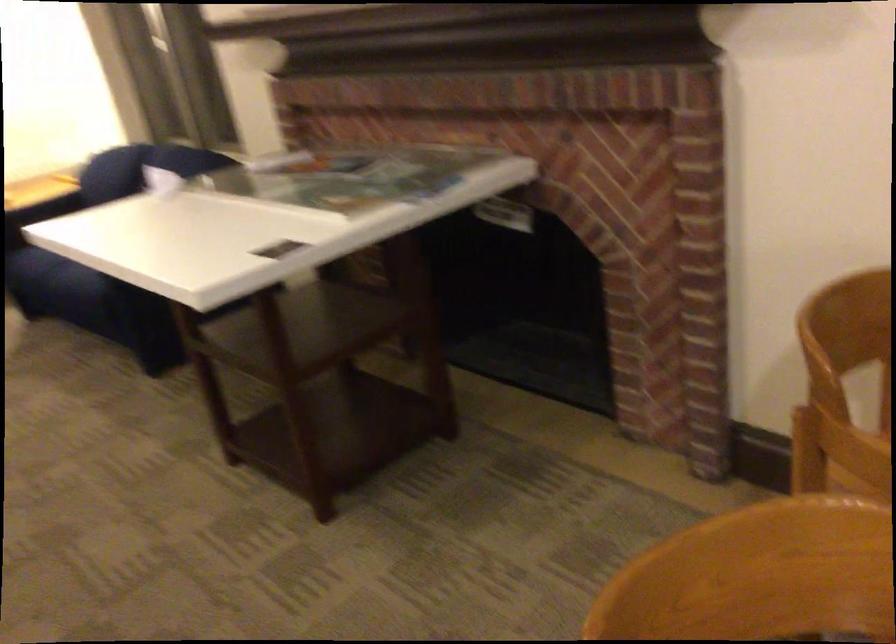
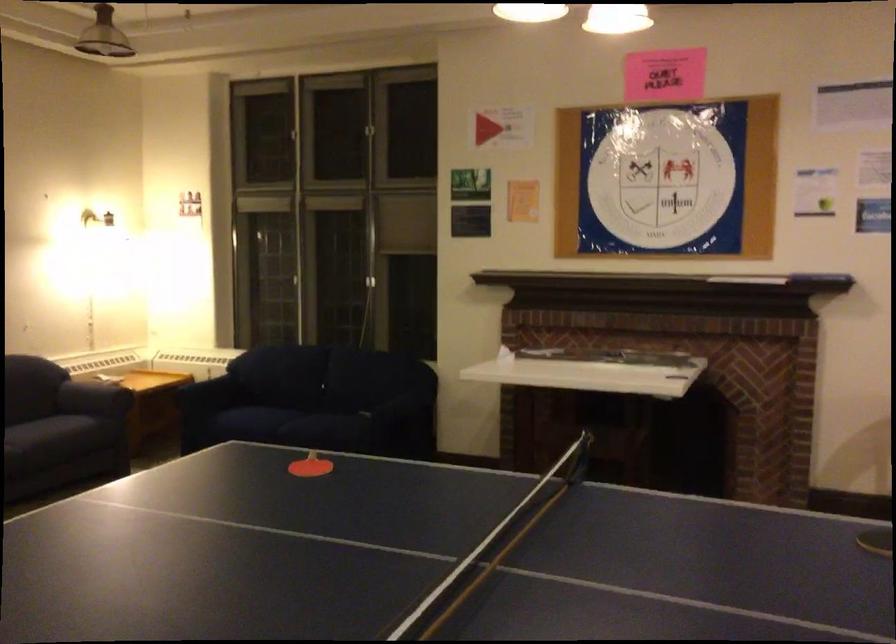
Question: I am providing you with two images of the same scene from different viewpoints. Which of the following objects are not visible in image2?

Choices:
 (A) dark sofa sitting surface
 (B) sofa armrest
 (C) coiled yellow cord
 (D) blue sofa armrest

Answer: (B)